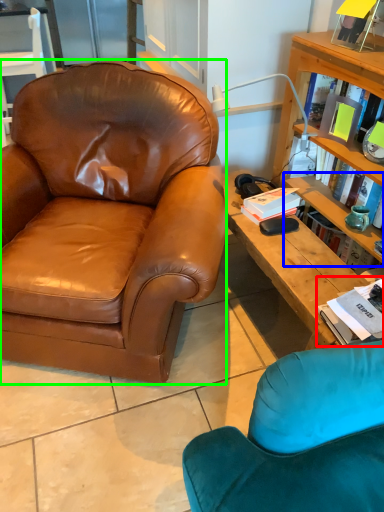
Question: Based on their relative distances, which object is nearer to book (highlighted by a red box)? Choose from shelf (highlighted by a blue box) and chair (highlighted by a green box).

Choices:
 (A) shelf
 (B) chair

Answer: (A)